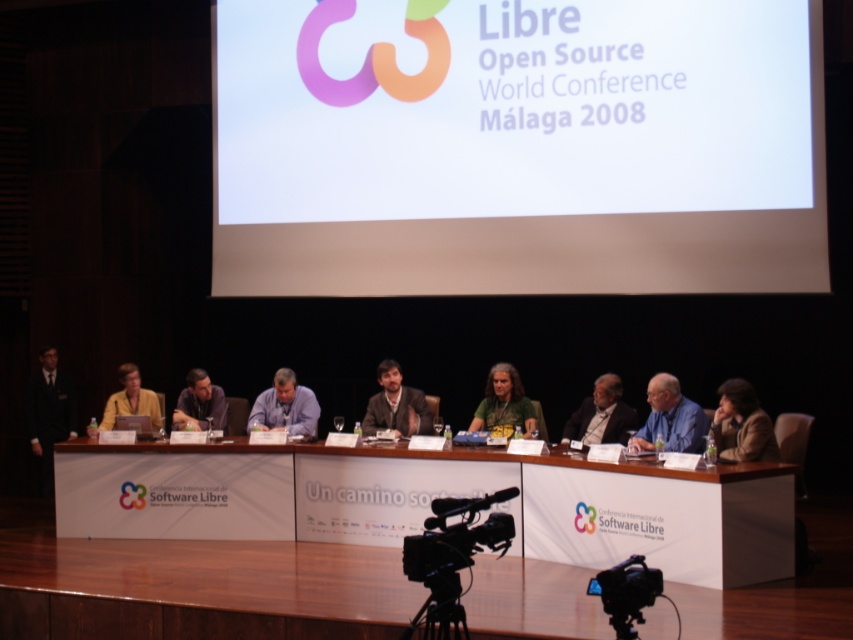
Which is above, white wood table at center or brown leather jacket at center?

brown leather jacket at center is higher up.

Who is more forward, (x=581, y=552) or (x=392, y=390)?

Point (x=581, y=552) is in front.

Locate an element on the screen. white wood table at center is located at coordinates (436, 497).

Does black plastic video camera at lower center lie behind black plastic video camera at lower right?

Yes.

Does black plastic video camera at lower center have a larger size compared to black plastic video camera at lower right?

Correct, black plastic video camera at lower center is larger in size than black plastic video camera at lower right.

The height and width of the screenshot is (640, 853). What do you see at coordinates (451, 557) in the screenshot?
I see `black plastic video camera at lower center` at bounding box center [451, 557].

Where is `black plastic video camera at lower center`? The width and height of the screenshot is (853, 640). black plastic video camera at lower center is located at coordinates (451, 557).

Who is taller, matte blue shirt at center or black plastic tripod at lower center?

matte blue shirt at center

Can you confirm if matte blue shirt at center is smaller than black plastic tripod at lower center?

No.

Who is more distant from viewer, (276,394) or (457,605)?

Point (276,394)

What are the coordinates of `matte blue shirt at center` in the screenshot? It's located at (285, 406).